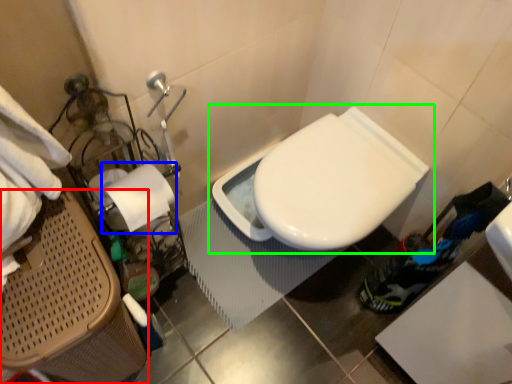
Question: Considering the real-world distances, which object is closest to laundry basket (highlighted by a red box)? toilet paper (highlighted by a blue box) or toilet (highlighted by a green box).

Choices:
 (A) toilet paper
 (B) toilet

Answer: (A)